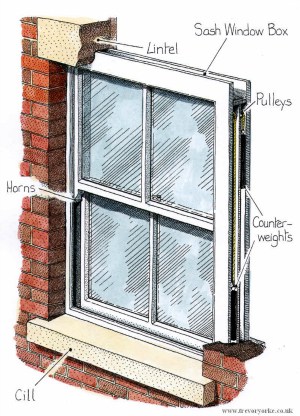
The image size is (300, 416). I want to click on color illustration of a window, so click(x=149, y=78).